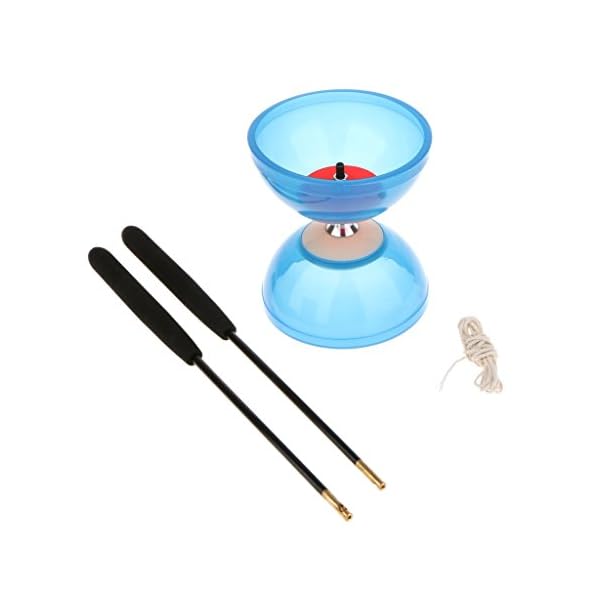
The image size is (600, 600). I want to click on bowl, so click(272, 116).